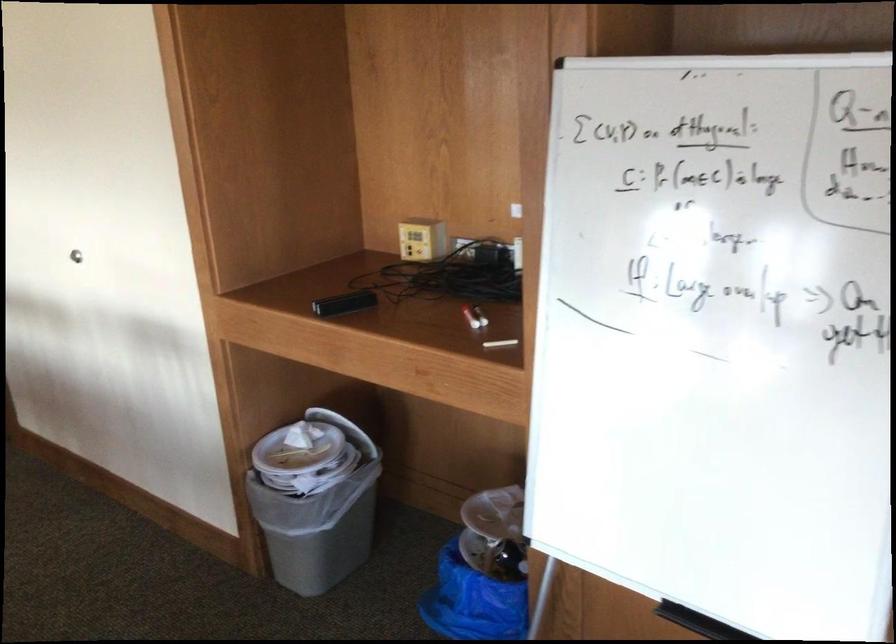
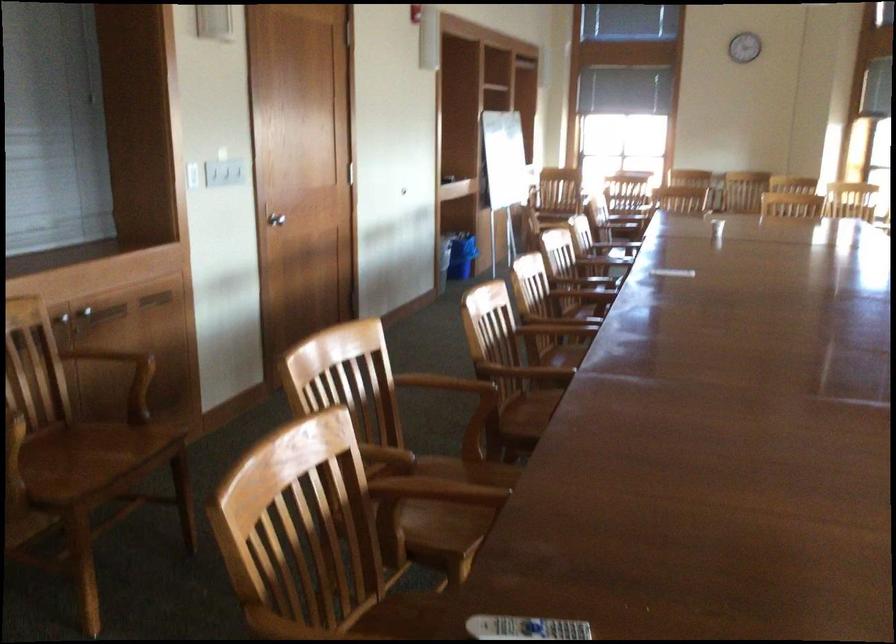
Question: I am providing you with two images of the same scene from different viewpoints. After the viewpoint changes to image2, which objects are now occluded?

Choices:
 (A) blue sofa sitting surface
 (B) silver door knob
 (C) wooden chair sitting surface
 (D) white remote control

Answer: (B)